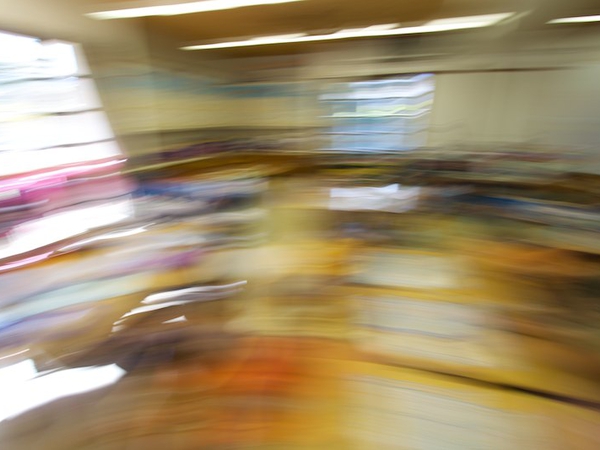
Identify the location of light. This screenshot has height=450, width=600. (23, 157).